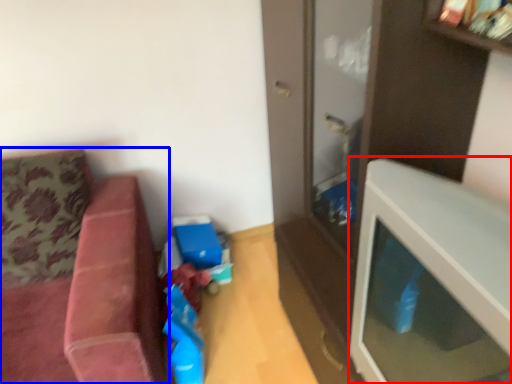
Question: Which point is further to the camera, table (highlighted by a red box) or studio couch (highlighted by a blue box)?

Choices:
 (A) table
 (B) studio couch

Answer: (B)